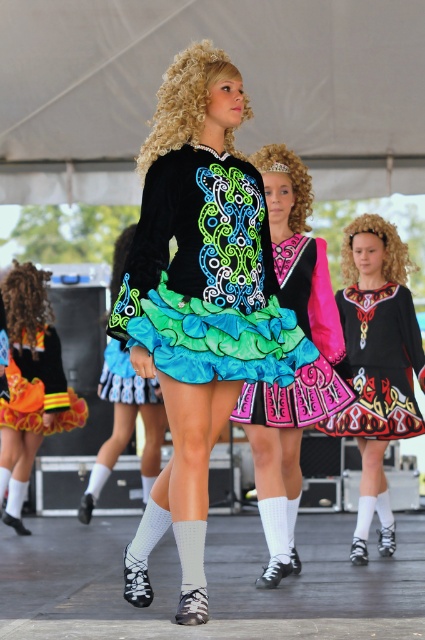
Question: Can you confirm if orange fabric skirt at left is positioned above multicolored sequined skirt at center?

Choices:
 (A) yes
 (B) no

Answer: (B)

Question: Is matte black dress at center smaller than black embroidered dress at center?

Choices:
 (A) no
 (B) yes

Answer: (A)

Question: Does matte black dress with colorful ruffles at center have a larger size compared to black velvet dress at center?

Choices:
 (A) yes
 (B) no

Answer: (B)

Question: Which object appears closest to the camera in this image?

Choices:
 (A) matte black dress with colorful ruffles at center
 (B) black velvet dress at center

Answer: (A)

Question: Among these objects, which one is nearest to the camera?

Choices:
 (A) black velvet dress at center
 (B) multicolored sequined skirt at center

Answer: (B)

Question: Which of these objects is positioned closest to the black embroidered dress at center?

Choices:
 (A) orange-yellow sequined skirt at lower left
 (B) black velvet dress at center

Answer: (B)